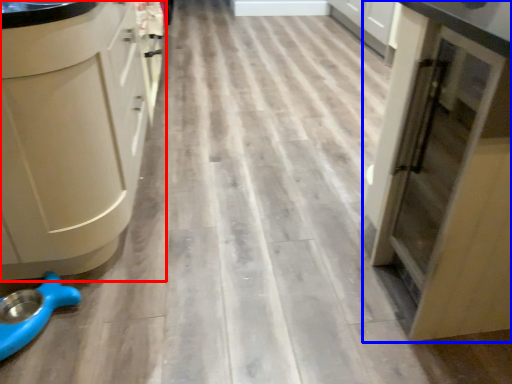
Question: Which of the following is the closest to the observer, cabinetry (highlighted by a red box) or cupboard (highlighted by a blue box)?

Choices:
 (A) cabinetry
 (B) cupboard

Answer: (B)